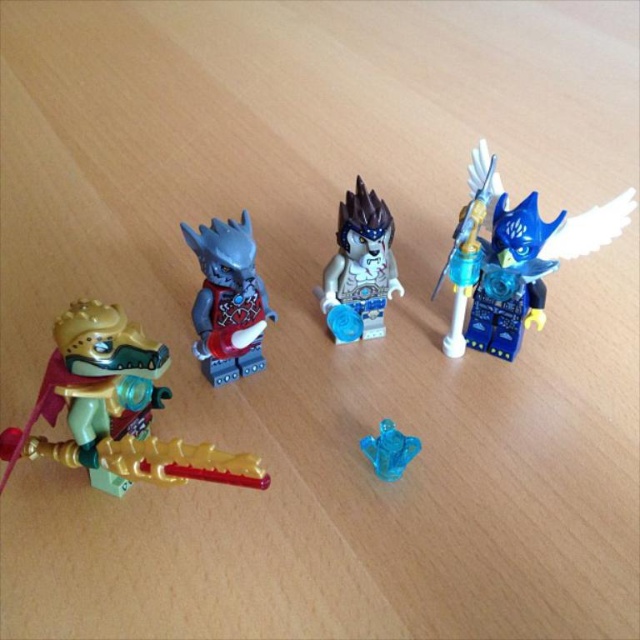
You are a photographer trying to capture the two points of interest in the image. The first point is at coordinate point(230,250) and the second is at point(380,465). Which point will appear larger in your photo?

Point(230,250) is closer to the camera than point(380,465), so it will appear larger in the photo.

You are a collector trying to place a protective case over the white glossy minifigure at center and the transparent blue gemstone at center. The case can only accommodate items up to the size of the gemstone. Will the case fit both objects?

The white glossy minifigure at center is larger in width than the transparent blue gemstone at center, so the case designed for the gemstone size will not fit the minifigure.

You are a collector trying to display the matte gray minifigure at center and the transparent blue gemstone at center on a shelf. If you want to place them side by side, which one will you need to adjust to fit on the shelf if the shelf has limited vertical space?

The matte gray minifigure at center is taller than the transparent blue gemstone at center, so you should adjust the matte gray minifigure at center to fit within the shelf height.